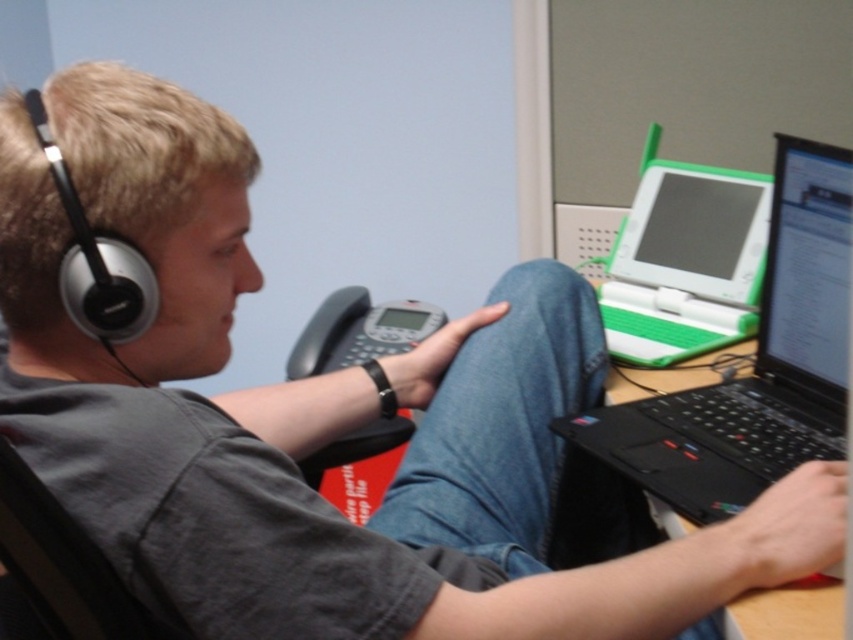
Question: Can you confirm if black plastic laptop at right is positioned above black matte earphone at left?

Choices:
 (A) yes
 (B) no

Answer: (B)

Question: Among these points, which one is farthest from the camera?

Choices:
 (A) (76, 220)
 (B) (726, 614)

Answer: (B)

Question: Is black matte earphone at left to the right of black plastic laptop at lower right from the viewer's perspective?

Choices:
 (A) yes
 (B) no

Answer: (B)

Question: Does black matte earphone at left have a greater width compared to black plastic laptop at lower right?

Choices:
 (A) no
 (B) yes

Answer: (A)

Question: Which is nearer to the black matte earphone at left?

Choices:
 (A) black plastic laptop at right
 (B) black plastic laptop at lower right

Answer: (A)

Question: Which of the following is the closest to the observer?

Choices:
 (A) (822, 456)
 (B) (627, 392)
 (C) (25, 100)

Answer: (C)